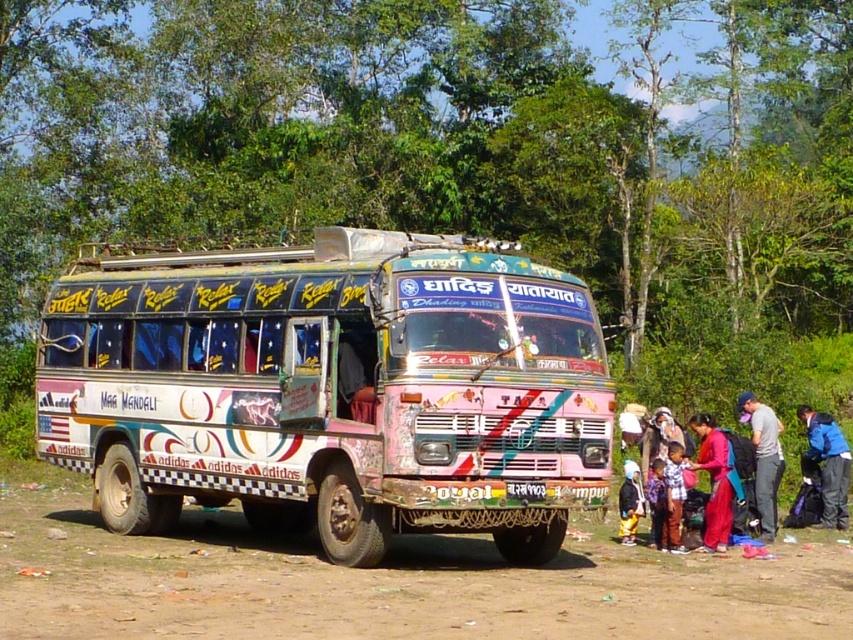
Which is behind, point (320, 406) or point (631, 531)?

The point (631, 531) is more distant.

Between point (408, 445) and point (625, 476), which one is positioned behind?

The point (625, 476) is more distant.

Locate an element on the screen. The height and width of the screenshot is (640, 853). painted wood bus at center is located at coordinates (332, 388).

Is plaid fabric shirt at lower right bigger than black fabric child at lower right?

Actually, plaid fabric shirt at lower right might be smaller than black fabric child at lower right.

Which is in front, point (675, 509) or point (625, 513)?

Point (675, 509)

Locate an element on the screen. Image resolution: width=853 pixels, height=640 pixels. plaid fabric shirt at lower right is located at coordinates (672, 497).

Does blue fabric bag at lower right appear under matte pink dress at lower right?

Correct, blue fabric bag at lower right is located below matte pink dress at lower right.

Can you confirm if blue fabric bag at lower right is positioned above matte pink dress at lower right?

No.

Is point (821, 456) more distant than point (717, 513)?

Yes, point (821, 456) is behind point (717, 513).

Find the location of a particular element. This screenshot has height=640, width=853. blue fabric bag at lower right is located at coordinates (827, 465).